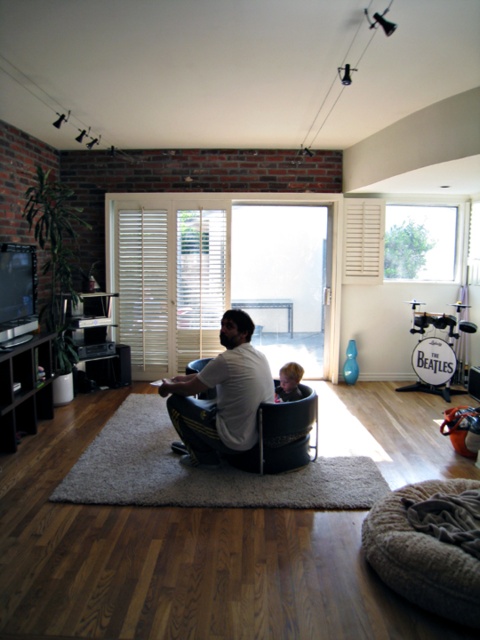
You are a person sitting on the beige textured bean bag at lower right and want to reach the smooth brown hair at lower center. Can you comfortably stretch your hand to touch it without moving your body?

The distance between the beige textured bean bag at lower right and the smooth brown hair at lower center is 4.37 feet. Since this distance is greater than an average person can reach with their arm, you cannot comfortably touch the smooth brown hair at lower center without moving.

You are a delivery person carrying a package that requires placing it on the nearest available surface. You are standing near the white cotton shirt at center. Which object, the beige textured bean bag at lower right or the black entertainment unit on the left, is closer to you?

The beige textured bean bag at lower right is closer to the white cotton shirt at center at a distance of 1.17 meters, so the beige textured bean bag at lower right is the nearest available surface.

You are a photographer setting up a shoot in this living room. You want to position a model so that their white cotton shirt at center and smooth brown hair at lower center are both in frame. Given that your camera has a focal length of 50mm and a sensor size of 24x36mm, will the distance between these two items affect the depth of field enough to require adjusting your aperture? Please explain using the provided measurements.

The distance between the white cotton shirt at center and smooth brown hair at lower center is 18.29 inches. Since depth of field is influenced by distance from the subject, having two elements at different distances may require adjusting the aperture to ensure both are in focus. A smaller aperture would increase depth of field, allowing both items to be sharp.